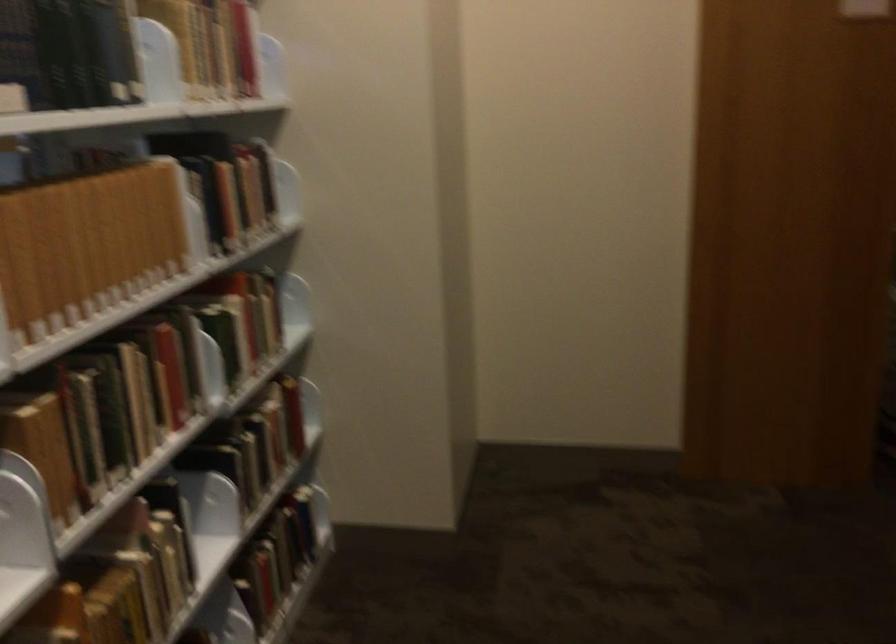
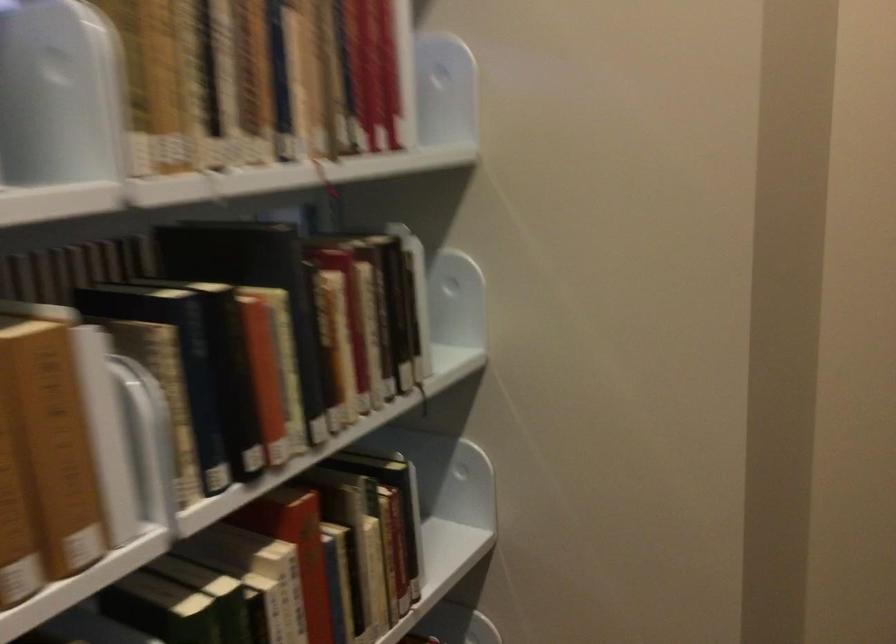
In the second image, find the point that corresponds to pixel 252 189 in the first image.

(366, 322)